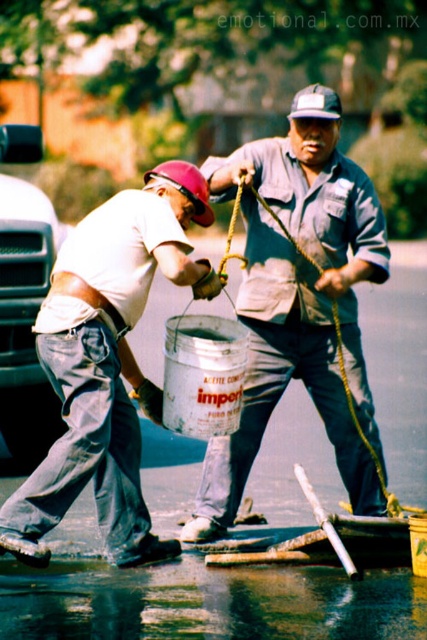
Is matte gray shirt at center shorter than matte white shirt at left?

In fact, matte gray shirt at center may be taller than matte white shirt at left.

Which is in front, point (348, 310) or point (116, 298)?

Point (116, 298) is in front.

Where is `matte gray shirt at center`? The width and height of the screenshot is (427, 640). matte gray shirt at center is located at coordinates (298, 301).

Which of these two, matte gray shirt at center or wet asphalt at lower center, stands shorter?

wet asphalt at lower center is shorter.

Can you confirm if matte gray shirt at center is positioned to the right of wet asphalt at lower center?

Correct, you'll find matte gray shirt at center to the right of wet asphalt at lower center.

Which is in front, point (292, 205) or point (227, 588)?

Point (227, 588)

I want to click on matte gray shirt at center, so click(x=298, y=301).

Can you confirm if matte white shirt at left is positioned below wet asphalt at lower center?

No.

Is matte white shirt at left wider than wet asphalt at lower center?

In fact, matte white shirt at left might be narrower than wet asphalt at lower center.

At what (x,y) coordinates should I click in order to perform the action: click on matte white shirt at left. Please return your answer as a coordinate pair (x, y). This screenshot has height=640, width=427. Looking at the image, I should click on (108, 362).